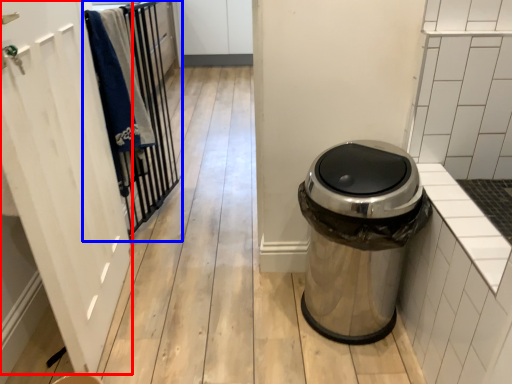
Question: Which object appears closest to the camera in this image, screen door (highlighted by a red box) or closet (highlighted by a blue box)?

Choices:
 (A) screen door
 (B) closet

Answer: (A)